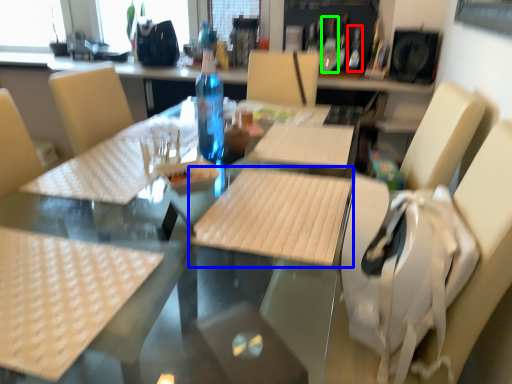
Question: Considering the real-world distances, which object is farthest from bottle (highlighted by a red box)? plywood (highlighted by a blue box) or wine bottle (highlighted by a green box)?

Choices:
 (A) plywood
 (B) wine bottle

Answer: (A)